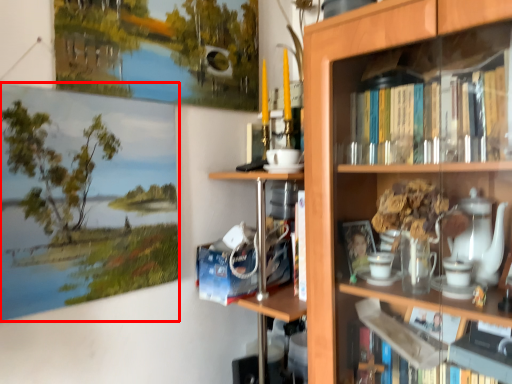
Question: From the image's perspective, considering the relative positions of picture frame (annotated by the red box) and bookcase in the image provided, where is picture frame (annotated by the red box) located with respect to the staircase?

Choices:
 (A) above
 (B) below

Answer: (A)